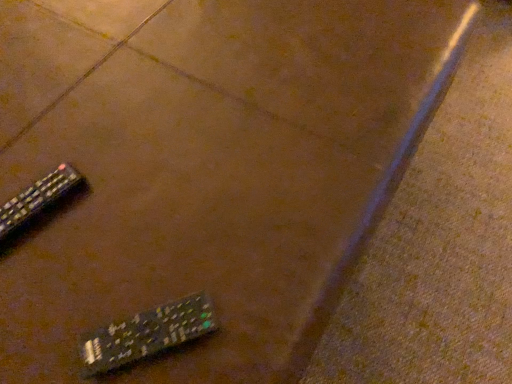
Measure the distance between black plastic remote at lower left, the first remote control positioned from the front, and camera.

black plastic remote at lower left, the first remote control positioned from the front, and camera are 17.43 inches apart from each other.

Identify the location of black plastic remote at lower left, which appears as the first remote control when ordered from the bottom. This screenshot has height=384, width=512. (147, 334).

This screenshot has width=512, height=384. Describe the element at coordinates (147, 334) in the screenshot. I see `black plastic remote at lower left, the 2th remote control positioned from the top` at that location.

What do you see at coordinates (37, 198) in the screenshot?
I see `black plastic remote at lower left, the 1th remote control positioned from the top` at bounding box center [37, 198].

Find the location of a particular element. This screenshot has height=384, width=512. black plastic remote at lower left, the 1th remote control in the left-to-right sequence is located at coordinates (37, 198).

Locate an element on the screen. The image size is (512, 384). black plastic remote at lower left, the 2th remote control positioned from the top is located at coordinates (147, 334).

Based on the photo, visually, is black plastic remote at lower left, the 1th remote control positioned from the top, positioned to the left or to the right of black plastic remote at lower left, the first remote control positioned from the front?

In the image, black plastic remote at lower left, the 1th remote control positioned from the top, appears on the left side of black plastic remote at lower left, the first remote control positioned from the front.

Does black plastic remote at lower left, the 1th remote control positioned from the top, lie behind black plastic remote at lower left, the first remote control positioned from the front?

Yes, the depth of black plastic remote at lower left, the 1th remote control positioned from the top, is greater than that of black plastic remote at lower left, the first remote control positioned from the front.

Is point (51, 184) positioned behind point (184, 314)?

Yes, point (51, 184) is farther from viewer.

In the scene shown: From the image's perspective, is black plastic remote at lower left, which is the 1th remote control from back to front, located beneath black plastic remote at lower left, arranged as the first remote control when viewed from the right?

No, from the image's perspective, black plastic remote at lower left, which is the 1th remote control from back to front, is not beneath black plastic remote at lower left, arranged as the first remote control when viewed from the right.

From a real-world perspective, is black plastic remote at lower left, which is the second remote control from front to back, located beneath black plastic remote at lower left, the 2th remote control positioned from the top?

Correct, in the physical world, black plastic remote at lower left, which is the second remote control from front to back, is lower than black plastic remote at lower left, the 2th remote control positioned from the top.

Does black plastic remote at lower left, which is the 2th remote control in bottom-to-top order, have a greater width compared to black plastic remote at lower left, which appears as the 2th remote control when viewed from the left?

Indeed, black plastic remote at lower left, which is the 2th remote control in bottom-to-top order, has a greater width compared to black plastic remote at lower left, which appears as the 2th remote control when viewed from the left.

Considering the sizes of black plastic remote at lower left, the 2th remote control viewed from the right, and black plastic remote at lower left, the 2th remote control positioned from the top, in the image, is black plastic remote at lower left, the 2th remote control viewed from the right, taller or shorter than black plastic remote at lower left, the 2th remote control positioned from the top,?

Considering their sizes, black plastic remote at lower left, the 2th remote control viewed from the right, has less height than black plastic remote at lower left, the 2th remote control positioned from the top.

Considering the sizes of black plastic remote at lower left, the 1th remote control in the left-to-right sequence, and black plastic remote at lower left, the 2th remote control positioned from the top, in the image, is black plastic remote at lower left, the 1th remote control in the left-to-right sequence, bigger or smaller than black plastic remote at lower left, the 2th remote control positioned from the top,?

Considering their sizes, black plastic remote at lower left, the 1th remote control in the left-to-right sequence, takes up less space than black plastic remote at lower left, the 2th remote control positioned from the top.

Would you say black plastic remote at lower left, which is the second remote control from front to back, is outside black plastic remote at lower left, the first remote control positioned from the front?

Yes, black plastic remote at lower left, which is the second remote control from front to back, is outside of black plastic remote at lower left, the first remote control positioned from the front.

Is black plastic remote at lower left, which is the second remote control from front to back, not close to black plastic remote at lower left, the 2th remote control positioned from the top?

No, black plastic remote at lower left, which is the second remote control from front to back, is not far from black plastic remote at lower left, the 2th remote control positioned from the top.

Is black plastic remote at lower left, which is the 1th remote control from back to front, positioned with its back to black plastic remote at lower left, arranged as the first remote control when viewed from the right?

No.

How distant is black plastic remote at lower left, the 1th remote control positioned from the top, from black plastic remote at lower left, arranged as the 2th remote control when viewed from the back?

A distance of 8.47 inches exists between black plastic remote at lower left, the 1th remote control positioned from the top, and black plastic remote at lower left, arranged as the 2th remote control when viewed from the back.

What are the coordinates of `remote control below the black plastic remote at lower left, arranged as the first remote control when viewed from the right (from a real-world perspective)` in the screenshot? It's located at (37, 198).

Based on their positions, is black plastic remote at lower left, which appears as the 2th remote control when viewed from the left, located to the left or right of black plastic remote at lower left, the 1th remote control positioned from the top?

In the image, black plastic remote at lower left, which appears as the 2th remote control when viewed from the left, appears on the right side of black plastic remote at lower left, the 1th remote control positioned from the top.

Considering the positions of objects black plastic remote at lower left, arranged as the first remote control when viewed from the right, and black plastic remote at lower left, which is the 2th remote control in bottom-to-top order, in the image provided, who is in front, black plastic remote at lower left, arranged as the first remote control when viewed from the right, or black plastic remote at lower left, which is the 2th remote control in bottom-to-top order,?

black plastic remote at lower left, arranged as the first remote control when viewed from the right.

Is point (184, 320) farther from camera compared to point (46, 189)?

No, (184, 320) is in front of (46, 189).

From the image's perspective, relative to black plastic remote at lower left, the 2th remote control viewed from the right, is black plastic remote at lower left, which appears as the first remote control when ordered from the bottom, above or below?

black plastic remote at lower left, which appears as the first remote control when ordered from the bottom, is below black plastic remote at lower left, the 2th remote control viewed from the right.

From a real-world perspective, between black plastic remote at lower left, which appears as the 2th remote control when viewed from the left, and black plastic remote at lower left, the 1th remote control in the left-to-right sequence, who is vertically higher?

In real-world perspective, black plastic remote at lower left, which appears as the 2th remote control when viewed from the left, is above.

From the picture: Is black plastic remote at lower left, arranged as the first remote control when viewed from the right, wider or thinner than black plastic remote at lower left, the 1th remote control positioned from the top?

black plastic remote at lower left, arranged as the first remote control when viewed from the right, is thinner than black plastic remote at lower left, the 1th remote control positioned from the top.

Considering the sizes of black plastic remote at lower left, the first remote control positioned from the front, and black plastic remote at lower left, which is the 1th remote control from back to front, in the image, is black plastic remote at lower left, the first remote control positioned from the front, taller or shorter than black plastic remote at lower left, which is the 1th remote control from back to front,?

Considering their sizes, black plastic remote at lower left, the first remote control positioned from the front, has more height than black plastic remote at lower left, which is the 1th remote control from back to front.

Considering the relative sizes of black plastic remote at lower left, the first remote control positioned from the front, and black plastic remote at lower left, the 1th remote control in the left-to-right sequence, in the image provided, is black plastic remote at lower left, the first remote control positioned from the front, smaller than black plastic remote at lower left, the 1th remote control in the left-to-right sequence,?

Actually, black plastic remote at lower left, the first remote control positioned from the front, might be larger than black plastic remote at lower left, the 1th remote control in the left-to-right sequence.

Is black plastic remote at lower left, which appears as the 2th remote control when viewed from the left, spatially inside black plastic remote at lower left, the 1th remote control positioned from the top, or outside of it?

black plastic remote at lower left, which appears as the 2th remote control when viewed from the left, exists outside the volume of black plastic remote at lower left, the 1th remote control positioned from the top.

Would you consider black plastic remote at lower left, which appears as the 2th remote control when viewed from the left, to be distant from black plastic remote at lower left, the 2th remote control viewed from the right?

black plastic remote at lower left, which appears as the 2th remote control when viewed from the left, is actually quite close to black plastic remote at lower left, the 2th remote control viewed from the right.

Could you tell me if black plastic remote at lower left, arranged as the 2th remote control when viewed from the back, is facing black plastic remote at lower left, the 2th remote control viewed from the right?

No, black plastic remote at lower left, arranged as the 2th remote control when viewed from the back, is not aimed at black plastic remote at lower left, the 2th remote control viewed from the right.

How different are the orientations of black plastic remote at lower left, arranged as the 2th remote control when viewed from the back, and black plastic remote at lower left, the 2th remote control viewed from the right, in degrees?

26.4 degrees.

Measure the distance between black plastic remote at lower left, arranged as the first remote control when viewed from the right, and black plastic remote at lower left, the 2th remote control viewed from the right.

black plastic remote at lower left, arranged as the first remote control when viewed from the right, and black plastic remote at lower left, the 2th remote control viewed from the right, are 8.47 inches apart.

Locate an element on the screen. This screenshot has width=512, height=384. remote control on the right of black plastic remote at lower left, the 2th remote control viewed from the right is located at coordinates (147, 334).

Locate an element on the screen. The image size is (512, 384). remote control on the left of black plastic remote at lower left, which appears as the 2th remote control when viewed from the left is located at coordinates (37, 198).

The height and width of the screenshot is (384, 512). I want to click on remote control above the black plastic remote at lower left, which appears as the first remote control when ordered from the bottom (from the image's perspective), so click(37, 198).